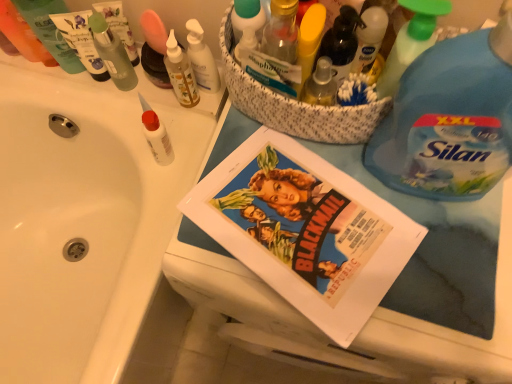
At what (x,y) coordinates should I click in order to perform the action: click on free space in front of green translucent bottle at upper left, which is the 4th toiletry in left-to-right order. Please return your answer as a coordinate pair (x, y). The image size is (512, 384). Looking at the image, I should click on (132, 124).